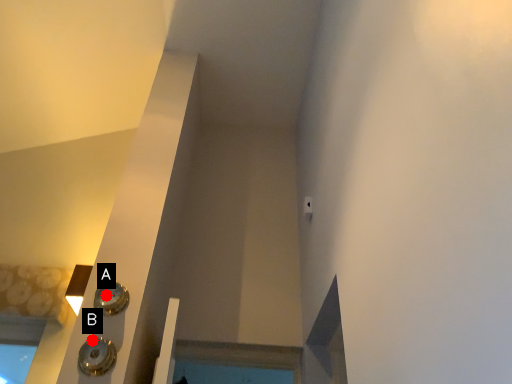
Question: Two points are circled on the image, labeled by A and B beside each circle. Which point is further to the camera?

Choices:
 (A) A is further
 (B) B is further

Answer: (A)